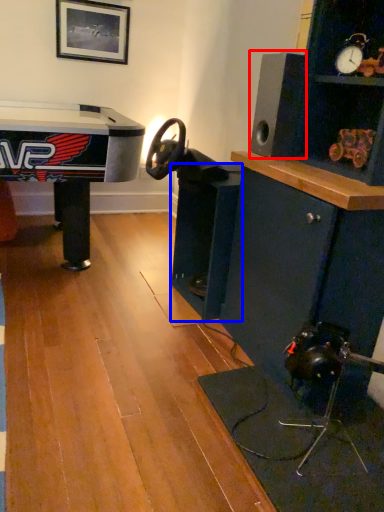
Question: Which object is closer to the camera taking this photo, speaker (highlighted by a red box) or shelf (highlighted by a blue box)?

Choices:
 (A) speaker
 (B) shelf

Answer: (A)